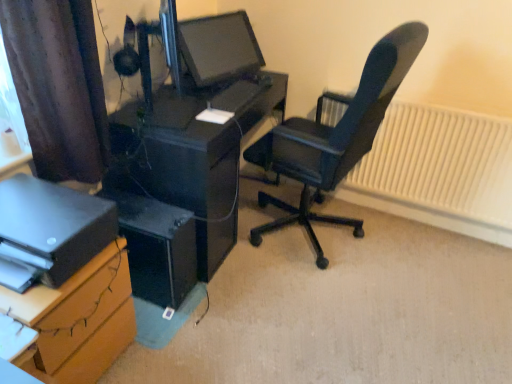
Measure the distance between point (442, 150) and camera.

7.52 feet.

The width and height of the screenshot is (512, 384). What do you see at coordinates (441, 163) in the screenshot?
I see `white textured radiator at right` at bounding box center [441, 163].

The image size is (512, 384). What do you see at coordinates (49, 231) in the screenshot?
I see `matte black printer at lower left` at bounding box center [49, 231].

From the picture: Measure the distance between matte black printer at lower left and camera.

1.20 meters.

Locate an element on the screen. The width and height of the screenshot is (512, 384). black glossy desk at center, the 1th desk in the back-to-front sequence is located at coordinates (200, 158).

Where is `brown fabric curtain at upper left`? This screenshot has width=512, height=384. brown fabric curtain at upper left is located at coordinates (58, 86).

Identify the location of black leather office chair at right. (334, 137).

How far apart are black glossy desk at center, acting as the 2th desk starting from the front, and black plastic computer tower at lower left?

The distance of black glossy desk at center, acting as the 2th desk starting from the front, from black plastic computer tower at lower left is 11.10 inches.

Is black glossy desk at center, acting as the 2th desk starting from the front, wider than black plastic computer tower at lower left?

Indeed, black glossy desk at center, acting as the 2th desk starting from the front, has a greater width compared to black plastic computer tower at lower left.

Which of these two, black glossy desk at center, acting as the 2th desk starting from the front, or black plastic computer tower at lower left, is smaller?

With smaller size is black plastic computer tower at lower left.

How different are the orientations of black glossy desk at center, acting as the 2th desk starting from the front, and black plastic computer tower at lower left in degrees?

There is a 0.000419-degree angle between the facing directions of black glossy desk at center, acting as the 2th desk starting from the front, and black plastic computer tower at lower left.

Which of these two, black glossy desk at center, the 1th desk in the back-to-front sequence, or matte black monitor at center, stands shorter?

Standing shorter between the two is matte black monitor at center.

Which is more to the right, black glossy desk at center, the 1th desk in the back-to-front sequence, or matte black monitor at center?

Positioned to the right is matte black monitor at center.

Looking at this image, is matte black printer at lower left positioned with its back to black leather office chair at right?

No, matte black printer at lower left is not facing the opposite direction of black leather office chair at right.

In the scene shown: From a real-world perspective, is matte black printer at lower left below black leather office chair at right?

No.

In terms of width, does matte black printer at lower left look wider or thinner when compared to black leather office chair at right?

In the image, matte black printer at lower left appears to be more narrow than black leather office chair at right.

Is matte black printer at lower left placed right next to black leather office chair at right?

No, matte black printer at lower left is not in contact with black leather office chair at right.

Consider the image. From a real-world perspective, does black plastic computer tower at lower left sit lower than matte black monitor at center?

Correct, in the physical world, black plastic computer tower at lower left is lower than matte black monitor at center.

Is black plastic computer tower at lower left wider or thinner than matte black monitor at center?

Considering their sizes, black plastic computer tower at lower left looks broader than matte black monitor at center.

Are black plastic computer tower at lower left and matte black monitor at center beside each other?

No, black plastic computer tower at lower left is not touching matte black monitor at center.

Is point (169, 286) positioned in front of point (198, 54)?

Yes.

Can you tell me how much white textured radiator at right and matte black printer at lower left differ in facing direction?

91 degrees.

Based on the photo, which object is wider, white textured radiator at right or matte black printer at lower left?

matte black printer at lower left.

Considering the positions of objects white textured radiator at right and matte black printer at lower left in the image provided, who is more to the left, white textured radiator at right or matte black printer at lower left?

matte black printer at lower left is more to the left.

Find the location of a particular element. printer located on the left of white textured radiator at right is located at coordinates (49, 231).

Is black plastic computer tower at lower left next to white textured radiator at right and touching it?

No, black plastic computer tower at lower left is not in contact with white textured radiator at right.

The width and height of the screenshot is (512, 384). I want to click on computer tower on the left of white textured radiator at right, so click(157, 247).

Does black plastic computer tower at lower left turn towards white textured radiator at right?

No, black plastic computer tower at lower left is not oriented towards white textured radiator at right.

Does matte black printer at lower left turn towards white textured radiator at right?

No, matte black printer at lower left is not aimed at white textured radiator at right.

Is matte black printer at lower left taller or shorter than white textured radiator at right?

Considering their sizes, matte black printer at lower left has less height than white textured radiator at right.

What's the angular difference between matte black printer at lower left and white textured radiator at right's facing directions?

The facing directions of matte black printer at lower left and white textured radiator at right are 91 degrees apart.

Locate an element on the screen. This screenshot has height=384, width=512. radiator behind the matte black printer at lower left is located at coordinates (441, 163).

In the image, there is a black plastic computer tower at lower left. Identify the location of desk above it (from the image's perspective). The width and height of the screenshot is (512, 384). (200, 158).

Where is `the 1st desk located beneath the matte black monitor at center (from a real-world perspective)`? the 1st desk located beneath the matte black monitor at center (from a real-world perspective) is located at coordinates (200, 158).

Estimate the real-world distances between objects in this image. Which object is further from black glossy desk at center, the 1th desk in the back-to-front sequence, matte black monitor at center or black leather office chair at right?

Among the two, black leather office chair at right is located further to black glossy desk at center, the 1th desk in the back-to-front sequence.

Considering their positions, is brown fabric curtain at upper left positioned further to brown cardboard at lower left, which appears as the first desk when viewed from the front, than black leather office chair at right?

black leather office chair at right is positioned further to the anchor brown cardboard at lower left, which appears as the first desk when viewed from the front.

Based on their spatial positions, is black leather office chair at right or brown fabric curtain at upper left further from matte black printer at lower left?

Based on the image, black leather office chair at right appears to be further to matte black printer at lower left.

Based on their spatial positions, is black leather office chair at right or black plastic computer tower at lower left closer to white textured radiator at right?

Based on the image, black leather office chair at right appears to be nearer to white textured radiator at right.

Considering their positions, is white textured radiator at right positioned further to black leather office chair at right than matte black monitor at center?

The object further to black leather office chair at right is matte black monitor at center.

Estimate the real-world distances between objects in this image. Which object is further from brown cardboard at lower left, the second desk from the back, matte black monitor at center or black leather office chair at right?

matte black monitor at center lies further to brown cardboard at lower left, the second desk from the back, than the other object.

When comparing their distances from brown cardboard at lower left, which appears as the first desk when viewed from the front, does black plastic computer tower at lower left or brown fabric curtain at upper left seem further?

brown fabric curtain at upper left lies further to brown cardboard at lower left, which appears as the first desk when viewed from the front, than the other object.

From the image, which object appears to be farther from brown cardboard at lower left, which appears as the first desk when viewed from the front, brown fabric curtain at upper left or matte black monitor at center?

Based on the image, matte black monitor at center appears to be further to brown cardboard at lower left, which appears as the first desk when viewed from the front.

Where is `chair located between matte black printer at lower left and white textured radiator at right in the left-right direction`? chair located between matte black printer at lower left and white textured radiator at right in the left-right direction is located at coordinates (334, 137).

You are a GUI agent. You are given a task and a screenshot of the screen. Output one action in this format:
    pyautogui.click(x=<x>, y=<y>)
    Task: Click on the desk situated between matte black printer at lower left and white textured radiator at right from left to right
    The height and width of the screenshot is (384, 512).
    Given the screenshot: What is the action you would take?
    pyautogui.click(x=200, y=158)

Where is `curtain located between brown cardboard at lower left, which appears as the first desk when viewed from the front, and white textured radiator at right in the left-right direction`? This screenshot has width=512, height=384. curtain located between brown cardboard at lower left, which appears as the first desk when viewed from the front, and white textured radiator at right in the left-right direction is located at coordinates [58, 86].

The image size is (512, 384). Identify the location of desk between brown cardboard at lower left, which appears as the first desk when viewed from the front, and white textured radiator at right from left to right. (200, 158).